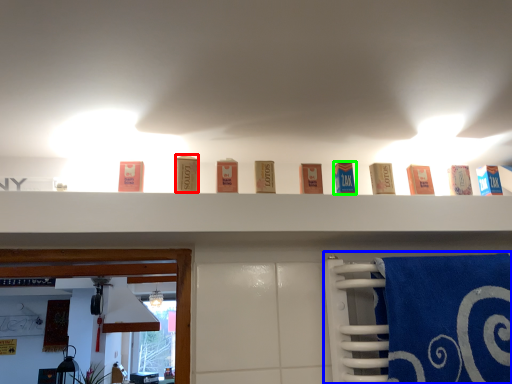
Question: Based on their relative distances, which object is nearer to product (highlighted by a red box)? Choose from bath towel (highlighted by a blue box) and product (highlighted by a green box).

Choices:
 (A) bath towel
 (B) product

Answer: (B)